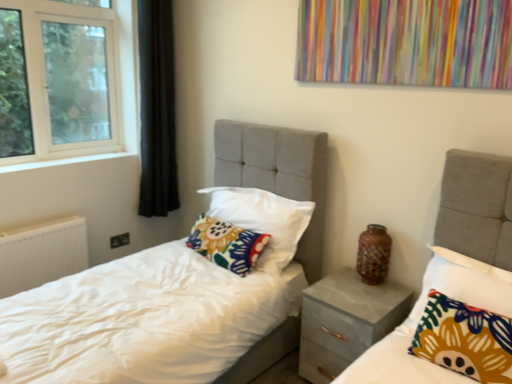
The width and height of the screenshot is (512, 384). Describe the element at coordinates (227, 244) in the screenshot. I see `floral fabric pillow at center, which appears as the first pillow when viewed from the back` at that location.

Describe the element at coordinates (263, 220) in the screenshot. I see `floral fabric pillow at center, the 2th pillow from the back` at that location.

This screenshot has width=512, height=384. I want to click on matte gray nightstand at center, so click(346, 321).

What do you see at coordinates (464, 339) in the screenshot?
I see `floral fabric pillow at center, arranged as the 1th pillow when viewed from the front` at bounding box center [464, 339].

I want to click on white textured radiator at lower left, so click(42, 254).

Measure the distance between shiny mosaic vase at center and camera.

shiny mosaic vase at center and camera are 7.08 feet apart.

What do you see at coordinates (373, 254) in the screenshot? Image resolution: width=512 pixels, height=384 pixels. I see `shiny mosaic vase at center` at bounding box center [373, 254].

Identify the location of floral fabric pillow at center, which appears as the first pillow when viewed from the back. The width and height of the screenshot is (512, 384). [227, 244].

Is floral fabric pillow at center, which appears as the 3th pillow when viewed from the back, next to matte gray nightstand at center and touching it?

No, floral fabric pillow at center, which appears as the 3th pillow when viewed from the back, is not beside matte gray nightstand at center.

From the image's perspective, is floral fabric pillow at center, which appears as the 3th pillow when viewed from the back, located beneath matte gray nightstand at center?

Incorrect, from the image's perspective, floral fabric pillow at center, which appears as the 3th pillow when viewed from the back, is higher than matte gray nightstand at center.

Between point (487, 362) and point (303, 340), which one is positioned behind?

The point (303, 340) is farther from the camera.

Which object is closer to the camera taking this photo, floral fabric pillow at center, arranged as the 1th pillow when viewed from the front, or matte gray nightstand at center?

floral fabric pillow at center, arranged as the 1th pillow when viewed from the front, is in front.

Is point (372, 238) closer or farther from the camera than point (64, 218)?

Point (372, 238) is positioned closer to the camera compared to point (64, 218).

Which of these two, shiny mosaic vase at center or white textured radiator at lower left, stands shorter?

shiny mosaic vase at center.

Does shiny mosaic vase at center appear on the left side of white textured radiator at lower left?

No, shiny mosaic vase at center is not to the left of white textured radiator at lower left.

Is the surface of shiny mosaic vase at center in direct contact with white textured radiator at lower left?

No, shiny mosaic vase at center is not next to white textured radiator at lower left.

Relative to shiny mosaic vase at center, is floral fabric pillow at center, which appears as the first pillow when viewed from the back, in front or behind?

Visually, floral fabric pillow at center, which appears as the first pillow when viewed from the back, is located behind shiny mosaic vase at center.

From a real-world perspective, is floral fabric pillow at center, which is the 3th pillow from front to back, located beneath shiny mosaic vase at center?

Yes, from a real-world perspective, floral fabric pillow at center, which is the 3th pillow from front to back, is beneath shiny mosaic vase at center.

Is floral fabric pillow at center, which appears as the first pillow when viewed from the back, far away from shiny mosaic vase at center?

No, floral fabric pillow at center, which appears as the first pillow when viewed from the back, is not far away from shiny mosaic vase at center.

Based on the photo, can you confirm if matte gray nightstand at center is taller than floral fabric pillow at center, which appears as the 3th pillow when viewed from the back?

Yes, matte gray nightstand at center is taller than floral fabric pillow at center, which appears as the 3th pillow when viewed from the back.

Can you confirm if matte gray nightstand at center is positioned to the left of floral fabric pillow at center, arranged as the 1th pillow when viewed from the front?

Yes, matte gray nightstand at center is to the left of floral fabric pillow at center, arranged as the 1th pillow when viewed from the front.

From the image's perspective, is matte gray nightstand at center below floral fabric pillow at center, which appears as the 3th pillow when viewed from the back?

Yes, from the image's perspective, matte gray nightstand at center is below floral fabric pillow at center, which appears as the 3th pillow when viewed from the back.

Does matte gray nightstand at center lie behind shiny mosaic vase at center?

No, matte gray nightstand at center is closer to the viewer.

Does matte gray nightstand at center contain shiny mosaic vase at center?

Definitely not — shiny mosaic vase at center is not inside matte gray nightstand at center.

Is matte gray nightstand at center facing towards shiny mosaic vase at center?

No, matte gray nightstand at center is not aimed at shiny mosaic vase at center.

Is floral fabric pillow at center, which appears as the first pillow when viewed from the back, not within white textured radiator at lower left?

Indeed, floral fabric pillow at center, which appears as the first pillow when viewed from the back, is completely outside white textured radiator at lower left.

Is floral fabric pillow at center, which appears as the first pillow when viewed from the back, in front of or behind white textured radiator at lower left in the image?

Visually, floral fabric pillow at center, which appears as the first pillow when viewed from the back, is located in front of white textured radiator at lower left.

Considering the positions of point (233, 262) and point (23, 257), is point (233, 262) closer or farther from the camera than point (23, 257)?

Point (233, 262) is closer to the camera than point (23, 257).

Is matte gray nightstand at center located within white textured radiator at lower left?

No, matte gray nightstand at center is not a part of white textured radiator at lower left.

Looking at this image, from a real-world perspective, does white textured radiator at lower left stand above matte gray nightstand at center?

Yes, from a real-world perspective, white textured radiator at lower left is above matte gray nightstand at center.

From the image's perspective, would you say white textured radiator at lower left is positioned over matte gray nightstand at center?

Yes, from the image's perspective, white textured radiator at lower left is on top of matte gray nightstand at center.

Can you confirm if white textured radiator at lower left is wider than matte gray nightstand at center?

No.

The width and height of the screenshot is (512, 384). I want to click on nightstand below the floral fabric pillow at center, arranged as the 1th pillow when viewed from the front (from a real-world perspective), so click(346, 321).

Identify the location of vase positioned vertically above the white textured radiator at lower left (from a real-world perspective). The image size is (512, 384). (373, 254).

When comparing their distances from floral fabric pillow at center, positioned as the 2th pillow in front-to-back order, does shiny mosaic vase at center or matte gray nightstand at center seem closer?

matte gray nightstand at center is positioned closer to the anchor floral fabric pillow at center, positioned as the 2th pillow in front-to-back order.

Considering their positions, is floral fabric pillow at center, which appears as the first pillow when viewed from the back, positioned further to white textured radiator at lower left than shiny mosaic vase at center?

The object further to white textured radiator at lower left is shiny mosaic vase at center.

Looking at the image, which one is located further to white textured radiator at lower left, floral fabric pillow at center, the 2th pillow from the back, or shiny mosaic vase at center?

shiny mosaic vase at center is further to white textured radiator at lower left.

When comparing their distances from matte gray nightstand at center, does shiny mosaic vase at center or floral fabric pillow at center, positioned as the 2th pillow in front-to-back order, seem closer?

The object closer to matte gray nightstand at center is shiny mosaic vase at center.

Considering their positions, is shiny mosaic vase at center positioned further to floral fabric pillow at center, which appears as the 3th pillow when viewed from the back, than white textured radiator at lower left?

white textured radiator at lower left is positioned further to the anchor floral fabric pillow at center, which appears as the 3th pillow when viewed from the back.

Estimate the real-world distances between objects in this image. Which object is closer to matte gray nightstand at center, floral fabric pillow at center, positioned as the 2th pillow in front-to-back order, or shiny mosaic vase at center?

shiny mosaic vase at center.

Considering their positions, is floral fabric pillow at center, which is the 3th pillow from front to back, positioned further to shiny mosaic vase at center than floral fabric pillow at center, arranged as the 1th pillow when viewed from the front?

floral fabric pillow at center, which is the 3th pillow from front to back, lies further to shiny mosaic vase at center than the other object.

When comparing their distances from floral fabric pillow at center, the 2th pillow from the back, does matte gray nightstand at center or shiny mosaic vase at center seem closer?

matte gray nightstand at center.

Where is `nightstand located between floral fabric pillow at center, the 2th pillow from the back, and shiny mosaic vase at center in the left-right direction`? The image size is (512, 384). nightstand located between floral fabric pillow at center, the 2th pillow from the back, and shiny mosaic vase at center in the left-right direction is located at coordinates (346, 321).

Identify the location of pillow situated between floral fabric pillow at center, which is the 3th pillow from front to back, and matte gray nightstand at center from left to right. [x=263, y=220].

The height and width of the screenshot is (384, 512). What are the coordinates of `vase between floral fabric pillow at center, positioned as the 2th pillow in front-to-back order, and floral fabric pillow at center, which appears as the 3th pillow when viewed from the back, from left to right` in the screenshot? It's located at (373, 254).

Find the location of `nightstand situated between floral fabric pillow at center, the 2th pillow from the back, and floral fabric pillow at center, arranged as the 1th pillow when viewed from the front, from left to right`. nightstand situated between floral fabric pillow at center, the 2th pillow from the back, and floral fabric pillow at center, arranged as the 1th pillow when viewed from the front, from left to right is located at coordinates (346, 321).